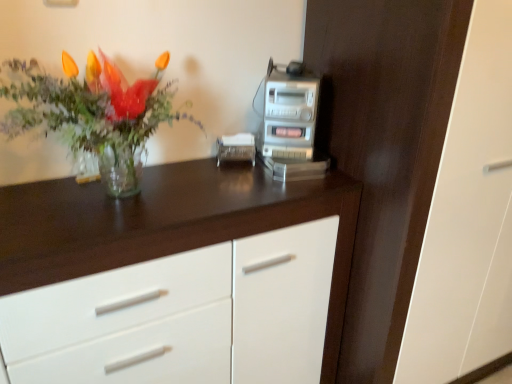
Question: Does silver metallic stereo at upper right have a greater width compared to dark wood dresser at center?

Choices:
 (A) no
 (B) yes

Answer: (A)

Question: From a real-world perspective, is silver metallic stereo at upper right over dark wood dresser at center?

Choices:
 (A) no
 (B) yes

Answer: (B)

Question: From the image's perspective, is silver metallic stereo at upper right located above dark wood dresser at center?

Choices:
 (A) no
 (B) yes

Answer: (B)

Question: Is silver metallic stereo at upper right next to dark wood dresser at center?

Choices:
 (A) yes
 (B) no

Answer: (B)

Question: From the image's perspective, is silver metallic stereo at upper right beneath dark wood dresser at center?

Choices:
 (A) no
 (B) yes

Answer: (A)

Question: In the image, is transparent glass vase at left on the left side or the right side of white glossy chest of drawers at center?

Choices:
 (A) right
 (B) left

Answer: (B)

Question: From the image's perspective, is transparent glass vase at left above or below white glossy chest of drawers at center?

Choices:
 (A) above
 (B) below

Answer: (A)

Question: Looking at the image, does transparent glass vase at left seem bigger or smaller compared to white glossy chest of drawers at center?

Choices:
 (A) big
 (B) small

Answer: (B)

Question: Is transparent glass vase at left in front of or behind white glossy chest of drawers at center in the image?

Choices:
 (A) behind
 (B) front

Answer: (B)

Question: Which is correct: dark wood dresser at center is inside white glossy chest of drawers at center, or outside of it?

Choices:
 (A) outside
 (B) inside

Answer: (A)

Question: In the image, is dark wood dresser at center positioned in front of or behind white glossy chest of drawers at center?

Choices:
 (A) front
 (B) behind

Answer: (B)

Question: Looking at the image, does dark wood dresser at center seem bigger or smaller compared to white glossy chest of drawers at center?

Choices:
 (A) big
 (B) small

Answer: (A)

Question: From a real-world perspective, is dark wood dresser at center positioned above or below white glossy chest of drawers at center?

Choices:
 (A) below
 (B) above

Answer: (B)

Question: Is point (432, 115) closer or farther from the camera than point (20, 82)?

Choices:
 (A) farther
 (B) closer

Answer: (B)

Question: From the image's perspective, is dark wood dresser at center located above or below transparent glass vase at left?

Choices:
 (A) above
 (B) below

Answer: (B)